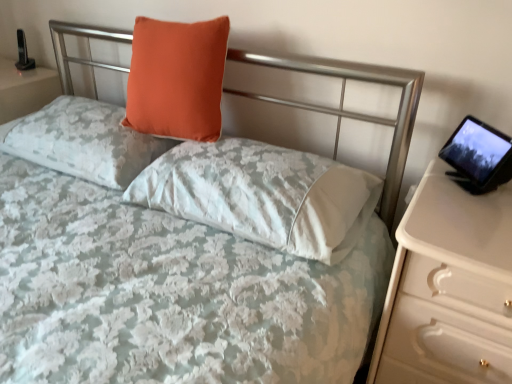
Question: Considering the relative sizes of white glossy nightstand at right and black glossy tablet at right in the image provided, is white glossy nightstand at right shorter than black glossy tablet at right?

Choices:
 (A) yes
 (B) no

Answer: (B)

Question: Is black glossy tablet at right at the back of white glossy nightstand at right?

Choices:
 (A) yes
 (B) no

Answer: (B)

Question: From the image's perspective, is white glossy nightstand at right located beneath black glossy tablet at right?

Choices:
 (A) no
 (B) yes

Answer: (B)

Question: Is white glossy nightstand at right touching black glossy tablet at right?

Choices:
 (A) yes
 (B) no

Answer: (B)

Question: Does white glossy nightstand at right have a smaller size compared to black glossy tablet at right?

Choices:
 (A) yes
 (B) no

Answer: (B)

Question: Is white glossy nightstand at right outside black glossy tablet at right?

Choices:
 (A) no
 (B) yes

Answer: (B)

Question: From the image's perspective, is white glossy nightstand at right below orange velvet pillow at upper center, which is the 2th pillow from right to left?

Choices:
 (A) yes
 (B) no

Answer: (A)

Question: From the image's perspective, is white glossy nightstand at right above orange velvet pillow at upper center, which is the 2th pillow from right to left?

Choices:
 (A) no
 (B) yes

Answer: (A)

Question: Considering the relative sizes of white glossy nightstand at right and orange velvet pillow at upper center, which is the 2th pillow from right to left, in the image provided, is white glossy nightstand at right taller than orange velvet pillow at upper center, which is the 2th pillow from right to left,?

Choices:
 (A) yes
 (B) no

Answer: (A)

Question: Is white glossy nightstand at right completely or partially outside of orange velvet pillow at upper center, which is the 2th pillow from right to left?

Choices:
 (A) no
 (B) yes

Answer: (B)

Question: From a real-world perspective, is white glossy nightstand at right located beneath orange velvet pillow at upper center, which is the 2th pillow from right to left?

Choices:
 (A) yes
 (B) no

Answer: (A)

Question: Is white glossy nightstand at right to the left of orange velvet pillow at upper center, which is the 2th pillow from right to left, from the viewer's perspective?

Choices:
 (A) yes
 (B) no

Answer: (B)

Question: Considering the relative sizes of orange velvet pillow at upper center, the second pillow in the left-to-right sequence, and matte orange pillow at upper left, placed as the first pillow when sorted from left to right, in the image provided, is orange velvet pillow at upper center, the second pillow in the left-to-right sequence, wider than matte orange pillow at upper left, placed as the first pillow when sorted from left to right,?

Choices:
 (A) yes
 (B) no

Answer: (B)